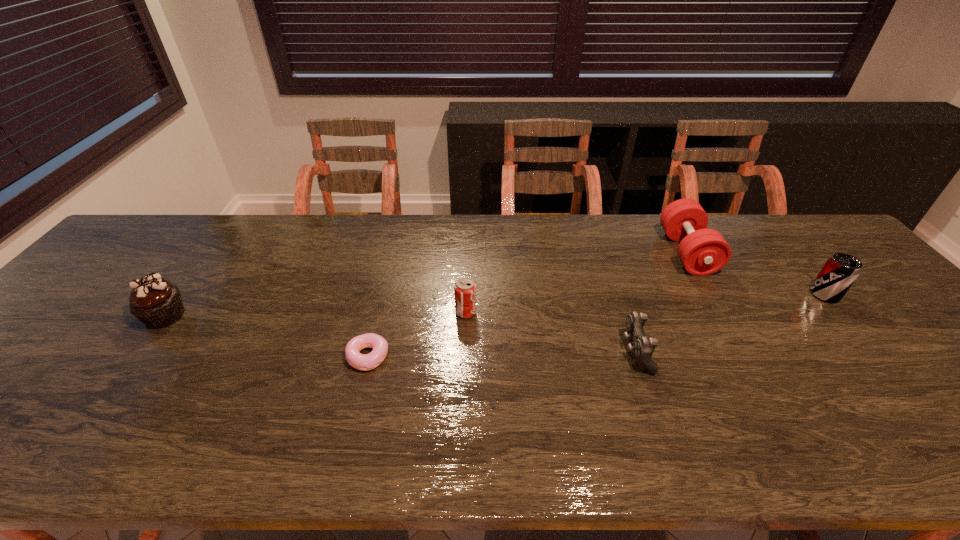
What are the coordinates of `empty space between the right soda can and the nearer soda can` in the screenshot? It's located at (645, 303).

Locate an element on the screen. The height and width of the screenshot is (540, 960). free point between the fifth object from left to right and the farther soda can is located at coordinates (756, 274).

You are a GUI agent. You are given a task and a screenshot of the screen. Output one action in this format:
    pyautogui.click(x=<x>, y=<y>)
    Task: Click on the vacant region between the shortest object and the fourth object from left to right
    The image size is (960, 540).
    Given the screenshot: What is the action you would take?
    pyautogui.click(x=502, y=354)

Identify the location of free space between the right soda can and the third object from right to left. (731, 323).

This screenshot has height=540, width=960. What are the coordinates of `free space between the control and the nearer soda can` in the screenshot? It's located at (551, 332).

The width and height of the screenshot is (960, 540). Find the location of `vacant space that is in between the cupcake and the dumbbell`. vacant space that is in between the cupcake and the dumbbell is located at coordinates (426, 284).

This screenshot has height=540, width=960. I want to click on object that ranks as the closest to the leftmost object, so tap(365, 362).

The height and width of the screenshot is (540, 960). Identify the location of object that is the second closest one to the right soda can. (643, 347).

What are the coordinates of `vacant space that satisfies the following two spatial constraints: 1. on the back side of the cupcake; 2. on the left side of the rightmost object` in the screenshot? It's located at [x=181, y=295].

Find the location of `vacant region that satisfies the following two spatial constraints: 1. on the front side of the fifth object from right to left; 2. on the left side of the cupcake`. vacant region that satisfies the following two spatial constraints: 1. on the front side of the fifth object from right to left; 2. on the left side of the cupcake is located at coordinates (135, 356).